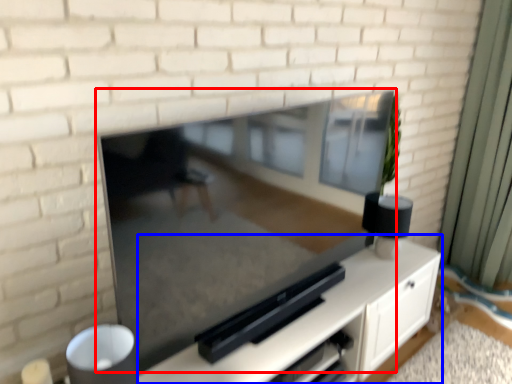
Question: Which object is further to the camera taking this photo, fireplace (highlighted by a red box) or entertainment center (highlighted by a blue box)?

Choices:
 (A) fireplace
 (B) entertainment center

Answer: (B)